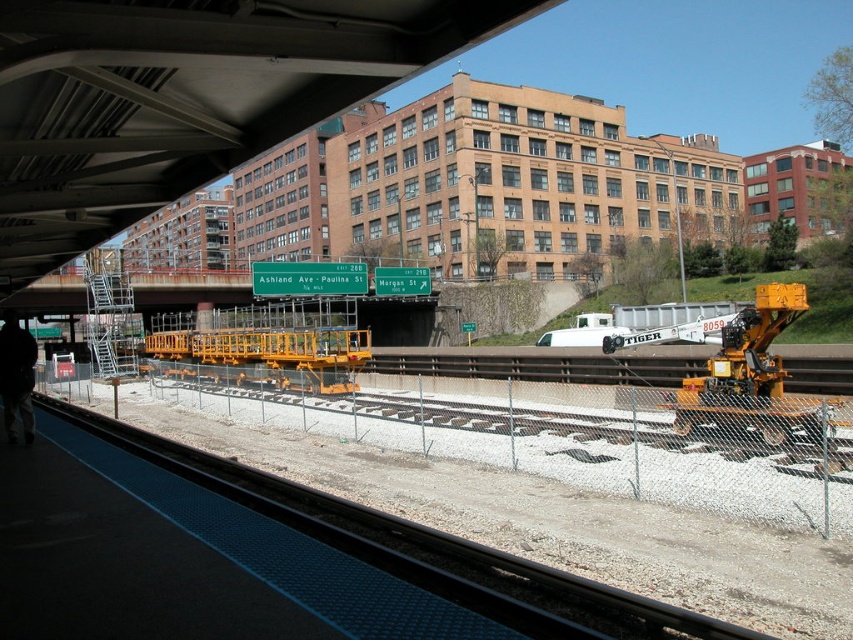
Question: Among these points, which one is farthest from the camera?

Choices:
 (A) (492, 556)
 (B) (18, 346)
 (C) (724, 403)

Answer: (C)

Question: Which of the following is the closest to the observer?

Choices:
 (A) black fabric at lower left
 (B) smooth concrete train track at lower center

Answer: (B)

Question: Among these points, which one is nearest to the camera?

Choices:
 (A) (721, 384)
 (B) (380, 561)
 (C) (30, 362)

Answer: (B)

Question: Is yellow metallic crane at right wider than black fabric at lower left?

Choices:
 (A) yes
 (B) no

Answer: (A)

Question: Does yellow metallic crane at right appear on the left side of black fabric at lower left?

Choices:
 (A) no
 (B) yes

Answer: (A)

Question: Is yellow metallic crane at right smaller than black fabric at lower left?

Choices:
 (A) yes
 (B) no

Answer: (B)